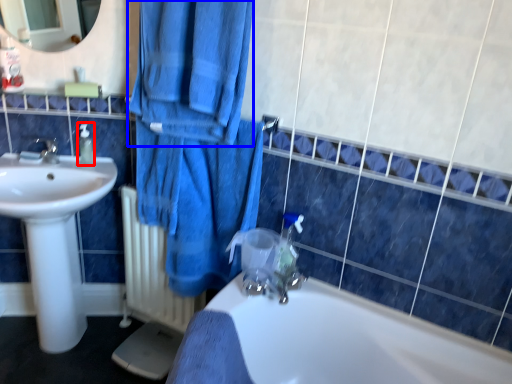
Question: Which object is further to the camera taking this photo, soap dispenser (highlighted by a red box) or bath towel (highlighted by a blue box)?

Choices:
 (A) soap dispenser
 (B) bath towel

Answer: (A)